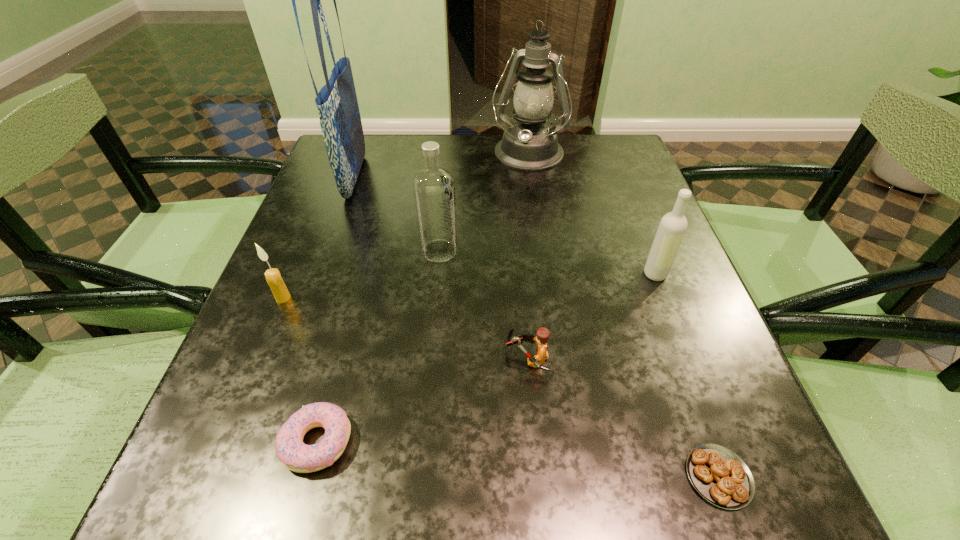
Locate an element on the screen. doughnut that is at the left edge is located at coordinates (296, 456).

What are the coordinates of `vodka that is at the right edge` in the screenshot? It's located at (673, 225).

At what (x,y) coordinates should I click in order to perform the action: click on pastry that is at the right edge. Please return your answer as a coordinate pair (x, y). Looking at the image, I should click on (720, 476).

You are a GUI agent. You are given a task and a screenshot of the screen. Output one action in this format:
    pyautogui.click(x=<x>, y=<y>)
    Task: Click on the object located in the far left corner section of the desktop
    The width and height of the screenshot is (960, 540).
    Given the screenshot: What is the action you would take?
    pyautogui.click(x=340, y=121)

The image size is (960, 540). Find the location of `object that is at the near left corner`. object that is at the near left corner is located at coordinates (296, 456).

Image resolution: width=960 pixels, height=540 pixels. Identify the location of object positioned at the near right corner. (720, 476).

Identify the location of free space at the far edge of the desktop. (452, 162).

This screenshot has height=540, width=960. In the image, there is a desktop. What are the coordinates of `blank space at the near edge` in the screenshot? It's located at (617, 497).

The width and height of the screenshot is (960, 540). In order to click on free region at the left edge of the desktop in this screenshot , I will do `click(253, 366)`.

Where is `vacant space at the right edge of the desktop`? This screenshot has width=960, height=540. vacant space at the right edge of the desktop is located at coordinates (681, 256).